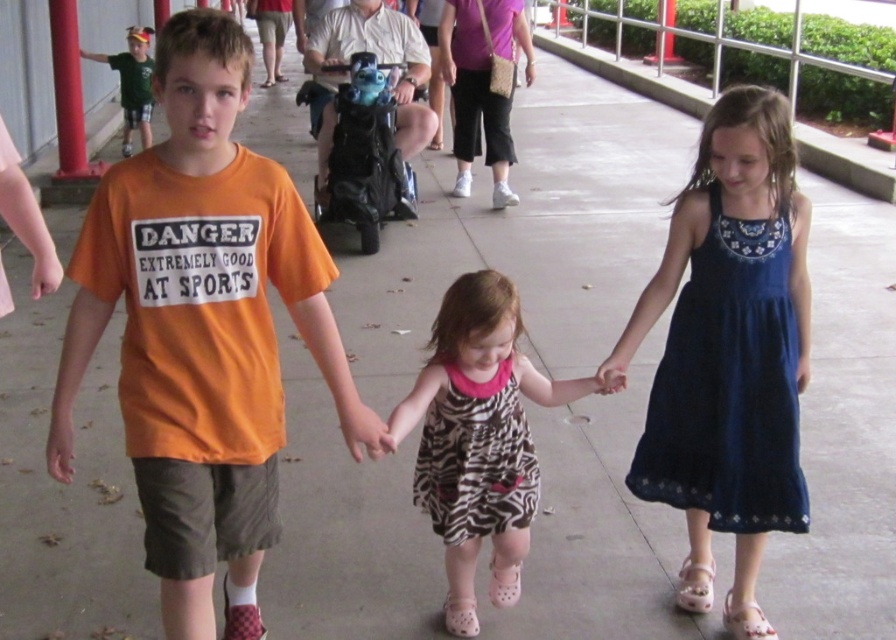
Who is taller, dark blue cotton dress at right or red painted metal pole at upper left?

With more height is red painted metal pole at upper left.

Does dark blue cotton dress at right appear on the left side of red painted metal pole at upper left?

Incorrect, dark blue cotton dress at right is not on the left side of red painted metal pole at upper left.

Where is `dark blue cotton dress at right`? The height and width of the screenshot is (640, 896). dark blue cotton dress at right is located at coordinates (729, 385).

Can you confirm if dark blue cotton dress at right is positioned above zebra print dress at center?

Yes.

Is point (694, 316) positioned after point (475, 316)?

Yes, it is.

At what (x,y) coordinates should I click in order to perform the action: click on dark blue cotton dress at right. Please return your answer as a coordinate pair (x, y). The image size is (896, 640). Looking at the image, I should click on (729, 385).

Who is taller, orange cotton t-shirt at center or dark blue cotton dress at right?

orange cotton t-shirt at center

Can you confirm if orange cotton t-shirt at center is smaller than dark blue cotton dress at right?

Incorrect, orange cotton t-shirt at center is not smaller in size than dark blue cotton dress at right.

Between point (125, 193) and point (804, 524), which one is positioned in front?

Point (125, 193) is more forward.

Identify the location of orange cotton t-shirt at center. Image resolution: width=896 pixels, height=640 pixels. (202, 330).